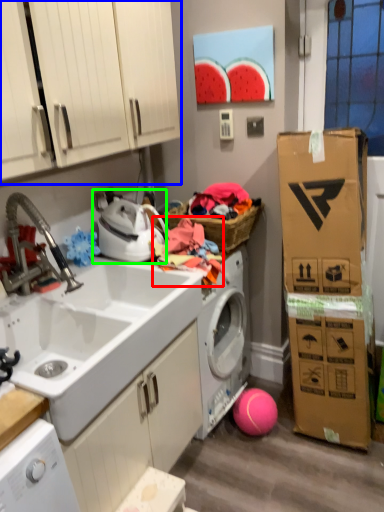
Question: Estimate the real-world distances between objects in this image. Which object is closer to clothing (highlighted by a red box), cabinetry (highlighted by a blue box) or appliance (highlighted by a green box)?

Choices:
 (A) cabinetry
 (B) appliance

Answer: (B)